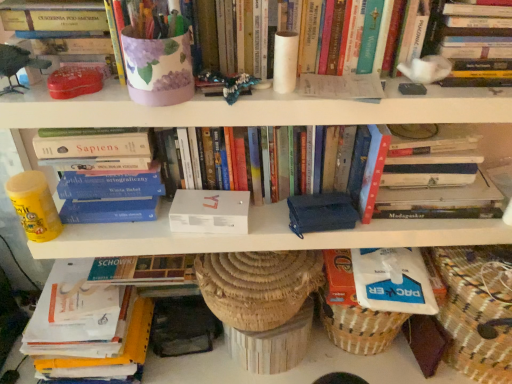
Question: Is white matte box at center, the first paperback book from the left, facing away from hardcover book at upper right, which appears as the sixth book when ordered from the bottom?

Choices:
 (A) no
 (B) yes

Answer: (A)

Question: Can we say white matte box at center, the second paperback book when ordered from right to left, lies outside hardcover book at upper right, which appears as the sixth book when ordered from the bottom?

Choices:
 (A) yes
 (B) no

Answer: (A)

Question: From a real-world perspective, is white matte box at center, the first paperback book from the left, positioned over hardcover book at upper right, which appears as the sixth book when ordered from the bottom, based on gravity?

Choices:
 (A) yes
 (B) no

Answer: (B)

Question: Does white matte box at center, the first paperback book from the left, appear on the right side of hardcover book at upper right, arranged as the 1th book when viewed from the top?

Choices:
 (A) no
 (B) yes

Answer: (A)

Question: Is white matte box at center, the second paperback book when ordered from right to left, thinner than hardcover book at upper right, arranged as the 1th book when viewed from the top?

Choices:
 (A) yes
 (B) no

Answer: (A)

Question: Is matte purple vase at upper center, which ranks as the fifth book in bottom-to-top order, in front of or behind white matte box at center, which ranks as the third book in bottom-to-top order, in the image?

Choices:
 (A) front
 (B) behind

Answer: (A)

Question: Would you say matte purple vase at upper center, which appears as the 2th book when viewed from the top, is to the left or to the right of white matte box at center, which ranks as the third book in bottom-to-top order, in the picture?

Choices:
 (A) right
 (B) left

Answer: (A)

Question: From a real-world perspective, is matte purple vase at upper center, which appears as the 2th book when viewed from the top, above or below white matte box at center, the fourth book from the top?

Choices:
 (A) below
 (B) above

Answer: (B)

Question: In terms of width, does matte purple vase at upper center, which ranks as the fifth book in bottom-to-top order, look wider or thinner when compared to white matte box at center, the fourth book from the top?

Choices:
 (A) thin
 (B) wide

Answer: (B)

Question: From a real-world perspective, is hardcover book at left, the 5th book from the top, above or below white paper book at lower left, which is the 1th book in bottom-to-top order?

Choices:
 (A) below
 (B) above

Answer: (B)

Question: Considering the positions of hardcover book at left, acting as the 2th book starting from the bottom, and white paper book at lower left, the 6th book viewed from the top, in the image, is hardcover book at left, acting as the 2th book starting from the bottom, taller or shorter than white paper book at lower left, the 6th book viewed from the top,?

Choices:
 (A) short
 (B) tall

Answer: (A)

Question: Which is correct: hardcover book at left, the 5th book from the top, is inside white paper book at lower left, which is the 1th book in bottom-to-top order, or outside of it?

Choices:
 (A) inside
 (B) outside

Answer: (B)

Question: Looking at the image, does hardcover book at left, acting as the 2th book starting from the bottom, seem bigger or smaller compared to white paper book at lower left, which is the 1th book in bottom-to-top order?

Choices:
 (A) big
 (B) small

Answer: (B)

Question: Is white paper book at lower left, which is the 1th book in bottom-to-top order, taller or shorter than matte purple vase at upper center, which appears as the 2th book when viewed from the top?

Choices:
 (A) tall
 (B) short

Answer: (A)

Question: Is white paper book at lower left, the 6th book viewed from the top, in front of or behind matte purple vase at upper center, which ranks as the fifth book in bottom-to-top order, in the image?

Choices:
 (A) front
 (B) behind

Answer: (B)